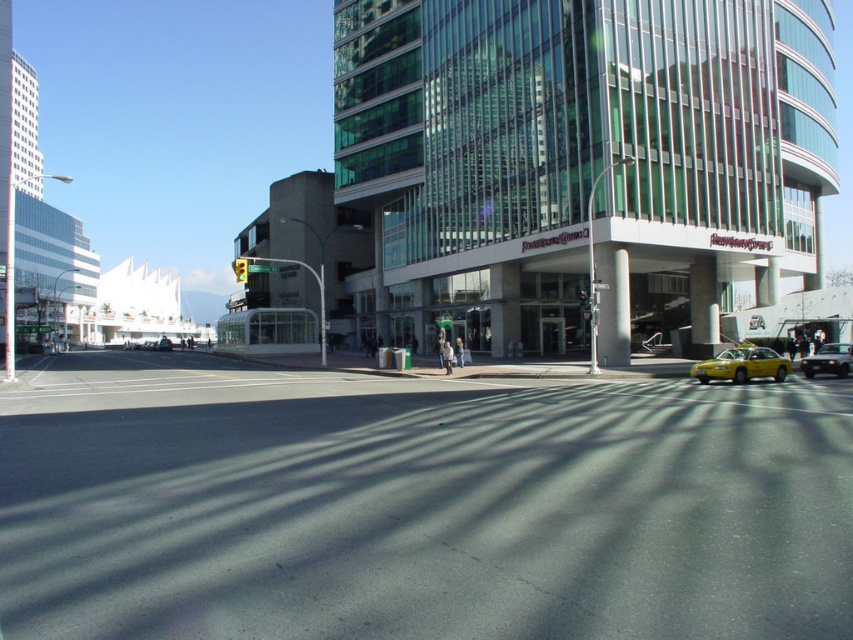
Which of these two, yellow matte taxi at lower right or metallic silver sedan at right, stands shorter?

yellow matte taxi at lower right

At what (x,y) coordinates should I click in order to perform the action: click on yellow matte taxi at lower right. Please return your answer as a coordinate pair (x, y). This screenshot has width=853, height=640. Looking at the image, I should click on (741, 365).

Identify the location of yellow matte taxi at lower right. This screenshot has height=640, width=853. (741, 365).

Between point (726, 364) and point (233, 262), which one is positioned behind?

The point (233, 262) is behind.

The image size is (853, 640). In order to click on yellow matte taxi at lower right in this screenshot , I will do `click(741, 365)`.

Where is `yellow matte taxi at lower right`? The height and width of the screenshot is (640, 853). yellow matte taxi at lower right is located at coordinates (741, 365).

Who is more forward, (143, 589) or (850, 360)?

Point (143, 589) is in front.

How distant is yellow rubber at center from metallic silver sedan at right?

60.70 feet

Between point (657, 397) and point (809, 356), which one is positioned behind?

Positioned behind is point (809, 356).

Locate an element on the screen. The height and width of the screenshot is (640, 853). yellow rubber at center is located at coordinates (416, 506).